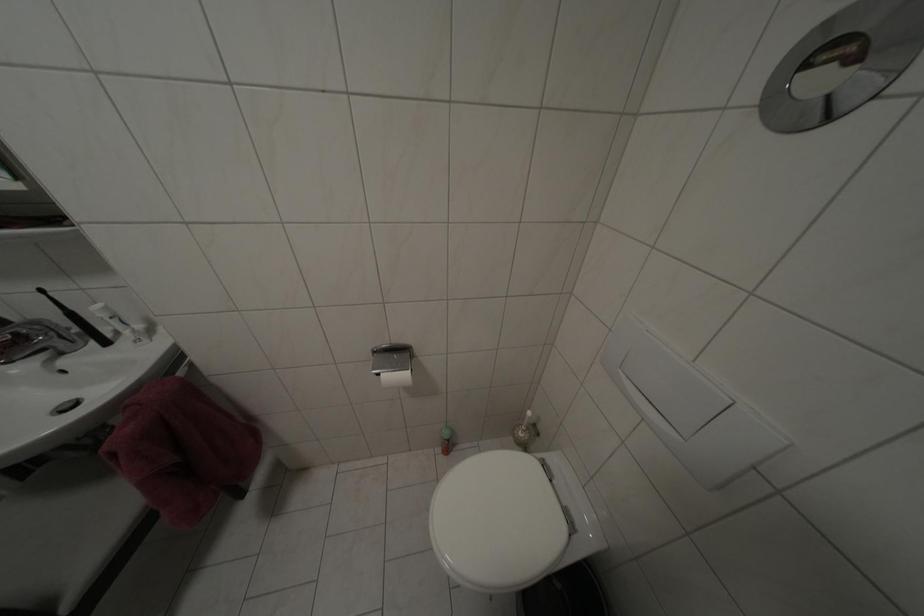
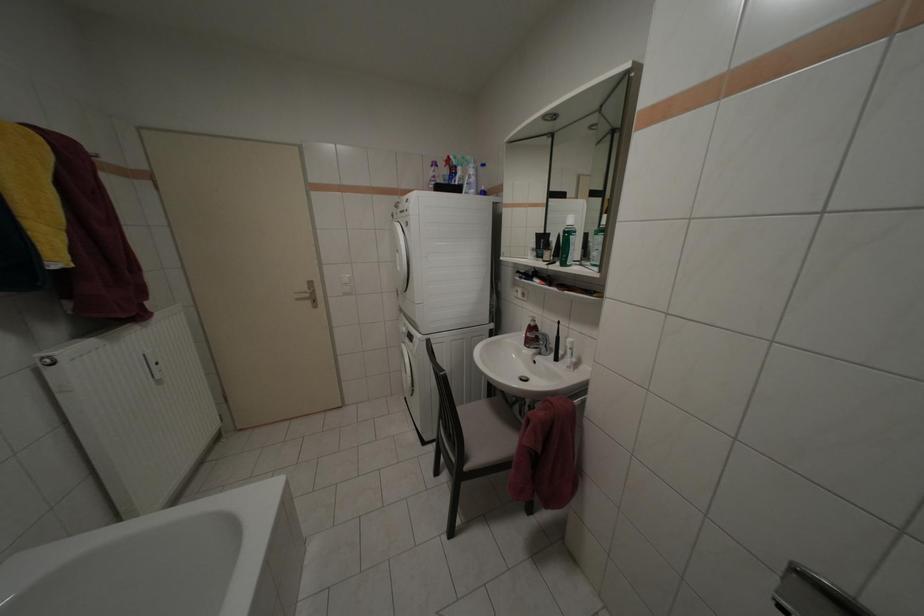
Question: Based on the continuous images, in which direction is the camera rotating? Reply with the corresponding letter.

Choices:
 (A) Left
 (B) Right
 (C) Up
 (D) Down

Answer: (A)